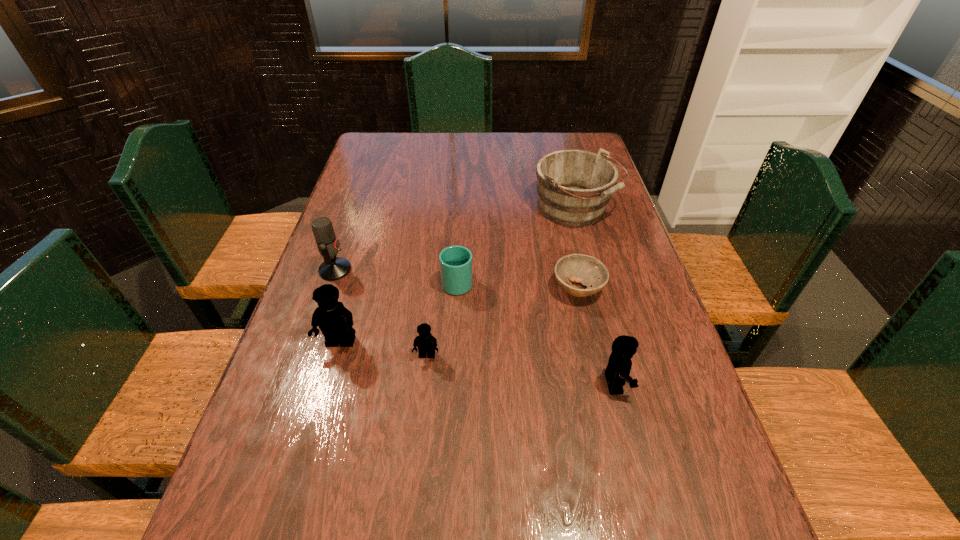
You are a GUI agent. You are given a task and a screenshot of the screen. Output one action in this format:
    pyautogui.click(x=<x>, y=<y>)
    Task: Click on the free spot located 0.070m on the front-facing side of the rightmost Lego
    The width and height of the screenshot is (960, 540).
    Given the screenshot: What is the action you would take?
    pyautogui.click(x=660, y=384)

I want to click on free region located 0.120m on the side of the microphone with the red ring, so click(x=395, y=270).

At what (x,y) coordinates should I click in order to perform the action: click on free space located on the front of the farthest object. Please return your answer as a coordinate pair (x, y). This screenshot has width=960, height=540. Looking at the image, I should click on (606, 323).

I want to click on blank space located 0.180m on the handle side of the cup, so click(460, 228).

The width and height of the screenshot is (960, 540). In order to click on vacant space located on the handle side of the cup in this screenshot , I will do `click(459, 256)`.

Find the location of a particular element. vacant area situated on the handle side of the cup is located at coordinates (459, 253).

What are the coordinates of `free space located on the back of the bowl` in the screenshot? It's located at (562, 215).

This screenshot has width=960, height=540. I want to click on Lego that is at the left edge, so click(335, 321).

At what (x,y) coordinates should I click in order to perform the action: click on microphone positioned at the left edge. Please return your answer as a coordinate pair (x, y). The height and width of the screenshot is (540, 960). Looking at the image, I should click on (333, 268).

The width and height of the screenshot is (960, 540). I want to click on Lego present at the right edge, so click(x=618, y=369).